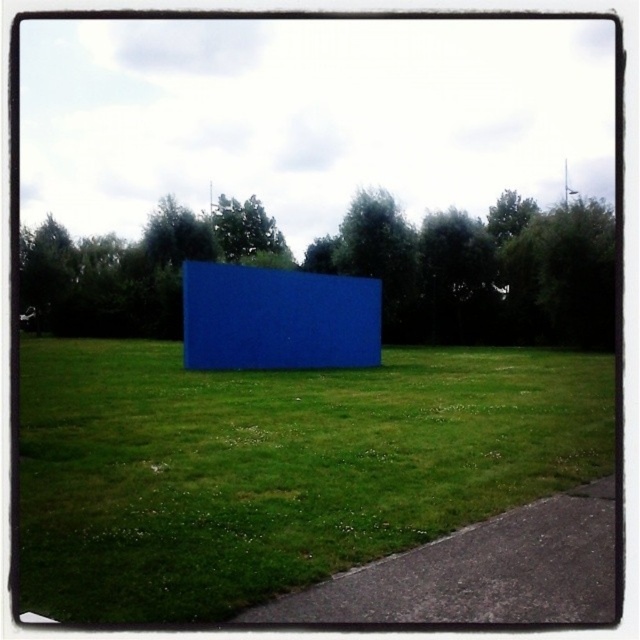
Question: Which of the following is the farthest from the observer?

Choices:
 (A) blue matte cube at center
 (B) blue matte rectangular object at center

Answer: (B)

Question: Which of the following is the closest to the observer?

Choices:
 (A) (426, 566)
 (B) (384, 236)

Answer: (A)

Question: Can you confirm if blue matte cube at center is smaller than blue matte rectangular object at center?

Choices:
 (A) no
 (B) yes

Answer: (B)

Question: Which of the following is the closest to the observer?

Choices:
 (A) (241, 388)
 (B) (432, 230)

Answer: (A)

Question: Is blue matte cube at center closer to camera compared to blue matte rectangular object at center?

Choices:
 (A) yes
 (B) no

Answer: (A)

Question: Can you confirm if blue matte cube at center is thinner than blue matte rectangular object at center?

Choices:
 (A) no
 (B) yes

Answer: (B)